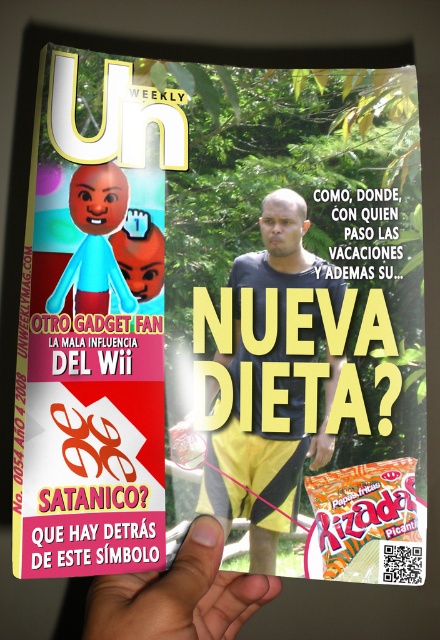
Question: Which point is farther to the camera?

Choices:
 (A) matte black shirt at center
 (B) matte plastic flyer at upper left
 (C) light skin tone finger at lower center
 (D) orange matte candy at lower right

Answer: (A)

Question: Does matte black shirt at center have a lesser width compared to light skin tone finger at lower center?

Choices:
 (A) yes
 (B) no

Answer: (A)

Question: Considering the relative positions of matte plastic flyer at upper left and orange matte candy at lower right in the image provided, where is matte plastic flyer at upper left located with respect to orange matte candy at lower right?

Choices:
 (A) above
 (B) below

Answer: (A)

Question: Can you confirm if light skin tone finger at lower center is bigger than orange matte candy at lower right?

Choices:
 (A) no
 (B) yes

Answer: (B)

Question: Among these objects, which one is farthest from the camera?

Choices:
 (A) matte black shirt at center
 (B) orange matte candy at lower right
 (C) light skin tone finger at lower center

Answer: (A)

Question: Which object is farther from the camera taking this photo?

Choices:
 (A) orange matte candy at lower right
 (B) light skin tone finger at lower center

Answer: (A)